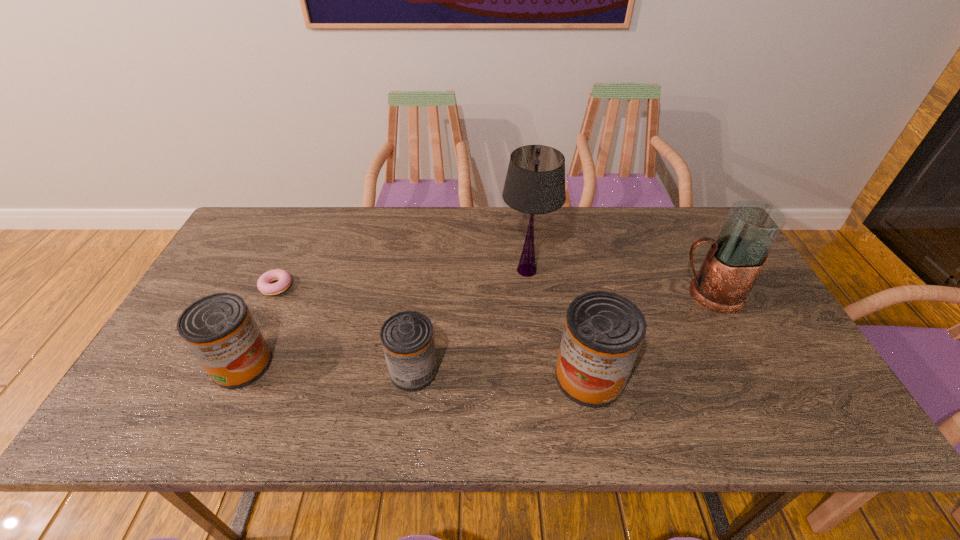
Where is `object located in the right edge section of the desktop`? The image size is (960, 540). object located in the right edge section of the desktop is located at coordinates (735, 259).

At what (x,y) coordinates should I click in order to perform the action: click on object present at the near left corner. Please return your answer as a coordinate pair (x, y). The height and width of the screenshot is (540, 960). Looking at the image, I should click on (219, 329).

This screenshot has width=960, height=540. Identify the location of vacant space at the far edge of the desktop. (348, 251).

In the image, there is a desktop. In order to click on vacant space at the near edge in this screenshot , I will do `click(463, 380)`.

In the image, there is a desktop. At what (x,y) coordinates should I click in order to perform the action: click on vacant space at the left edge. Please return your answer as a coordinate pair (x, y). Looking at the image, I should click on (202, 294).

Image resolution: width=960 pixels, height=540 pixels. Identify the location of vacant space at the right edge of the desktop. (746, 315).

This screenshot has height=540, width=960. Identify the location of free point at the far left corner. (284, 220).

You are a GUI agent. You are given a task and a screenshot of the screen. Output one action in this format:
    pyautogui.click(x=<x>, y=<y>)
    Task: Click on the free space at the far right corner of the desktop
    This screenshot has height=540, width=960.
    Given the screenshot: What is the action you would take?
    pyautogui.click(x=699, y=211)

Where is `empty location between the second tallest can and the lampshade`? This screenshot has height=540, width=960. empty location between the second tallest can and the lampshade is located at coordinates (384, 318).

Identify the location of free space between the shortest can and the rightmost can. This screenshot has width=960, height=540. [501, 374].